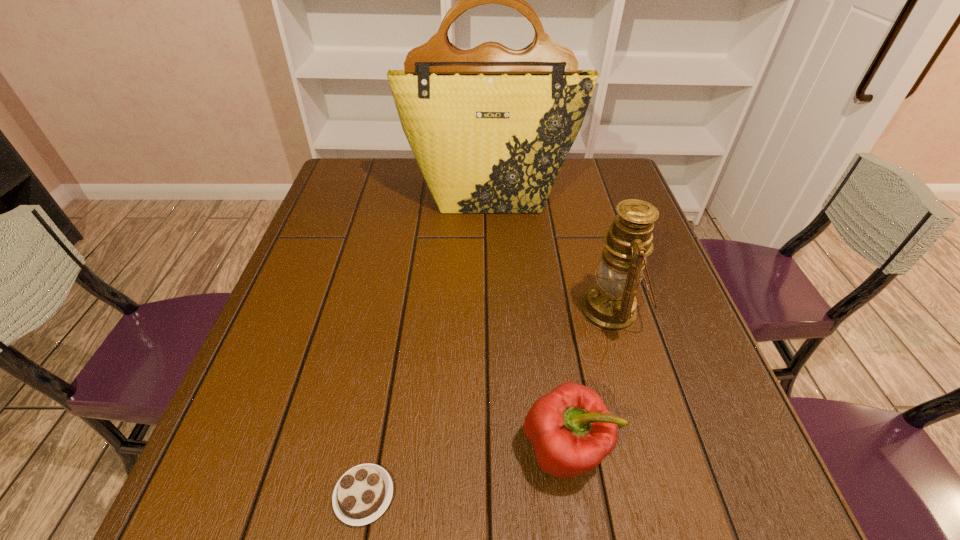
Locate an element on the screen. This screenshot has width=960, height=540. vacant space that is in between the third shortest object and the tallest object is located at coordinates (551, 253).

Identify the location of vacant point located between the third nearest object and the chocolate cake. The image size is (960, 540). (488, 403).

This screenshot has width=960, height=540. Identify the location of blank region between the tote bag and the chocolate cake. (427, 345).

The width and height of the screenshot is (960, 540). In order to click on vacant area between the tote bag and the bell pepper in this screenshot , I will do `click(528, 322)`.

You are a GUI agent. You are given a task and a screenshot of the screen. Output one action in this format:
    pyautogui.click(x=<x>, y=<y>)
    Task: Click on the vacant point located between the third shortest object and the shortest object
    This screenshot has height=540, width=960.
    Given the screenshot: What is the action you would take?
    pyautogui.click(x=488, y=403)

Where is `free space between the second farthest object and the bell pepper`? This screenshot has width=960, height=540. free space between the second farthest object and the bell pepper is located at coordinates pyautogui.click(x=588, y=380).

Locate an element on the screen. This screenshot has width=960, height=540. vacant space that is in between the chocolate cake and the tote bag is located at coordinates (427, 345).

Identify the location of vacant space that's between the third shortest object and the third tallest object. Image resolution: width=960 pixels, height=540 pixels. (588, 380).

Identify the location of vacant space that's between the shortest object and the second shortest object. (465, 472).

Where is `empty space that is in between the chocolate cake and the second shortest object`? The image size is (960, 540). empty space that is in between the chocolate cake and the second shortest object is located at coordinates (465, 472).